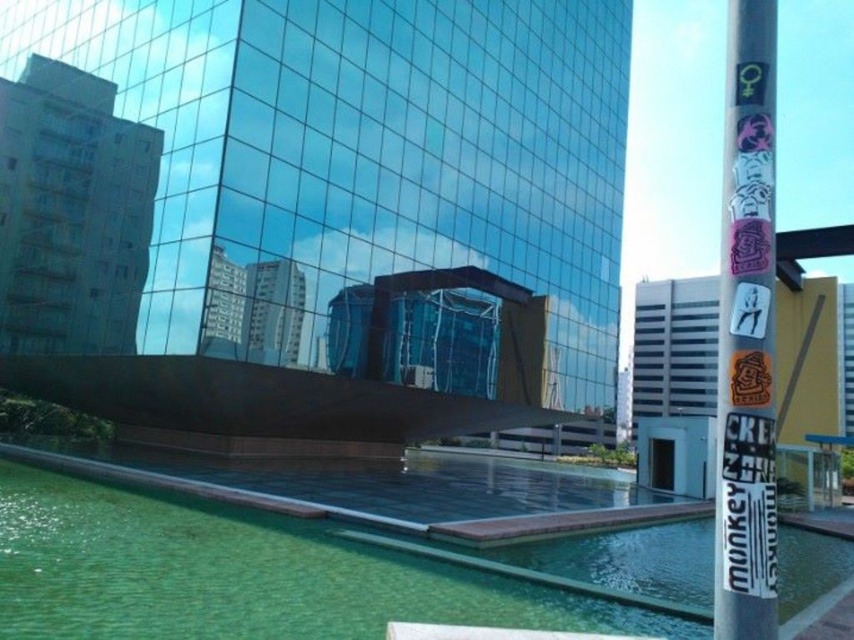
Is point (262, 577) farther from camera compared to point (733, 346)?

Yes, it is.

Does green glass pool at center appear on the left side of silver metallic pole at right?

Indeed, green glass pool at center is positioned on the left side of silver metallic pole at right.

The image size is (854, 640). In order to click on green glass pool at center in this screenshot , I will do `click(244, 573)`.